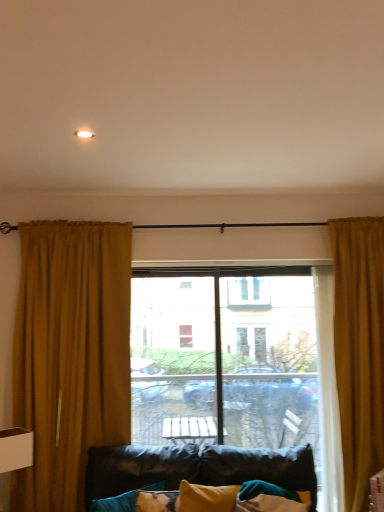
Question: Is transparent glass window at center wider or thinner than golden textured curtain at right, which appears as the 1th curtain when viewed from the right?

Choices:
 (A) thin
 (B) wide

Answer: (A)

Question: Does point (299, 434) appear closer or farther from the camera than point (349, 443)?

Choices:
 (A) farther
 (B) closer

Answer: (A)

Question: Estimate the real-world distances between objects in this image. Which object is closer to the transparent glass window at center?

Choices:
 (A) velvet teal pillow at lower left
 (B) mustard velvet curtain at left, the 1th curtain when ordered from left to right
 (C) golden textured curtain at right, which appears as the 1th curtain when viewed from the right

Answer: (C)

Question: Estimate the real-world distances between objects in this image. Which object is farther from the velvet teal pillow at lower left?

Choices:
 (A) golden textured curtain at right, which is the 2th curtain in left-to-right order
 (B) transparent glass window at center
 (C) mustard velvet curtain at left, placed as the second curtain when sorted from right to left

Answer: (A)